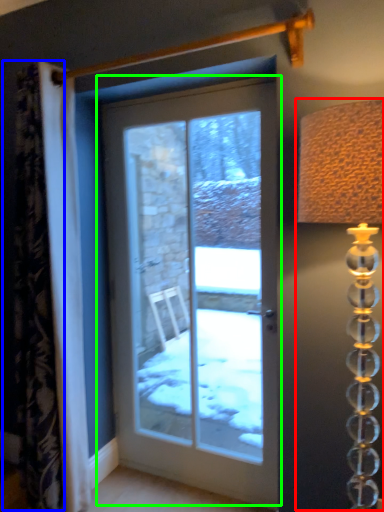
Question: Estimate the real-world distances between objects in this image. Which object is closer to table lamp (highlighted by a red box), curtain (highlighted by a blue box) or door (highlighted by a green box)?

Choices:
 (A) curtain
 (B) door

Answer: (A)